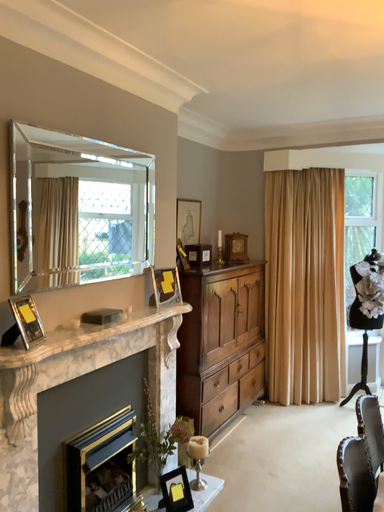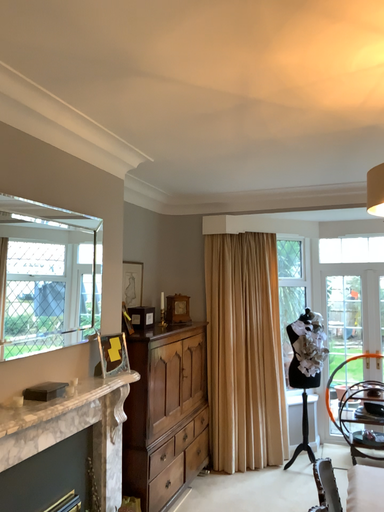
Question: Which way did the camera rotate in the video?

Choices:
 (A) rotated right
 (B) rotated left

Answer: (A)